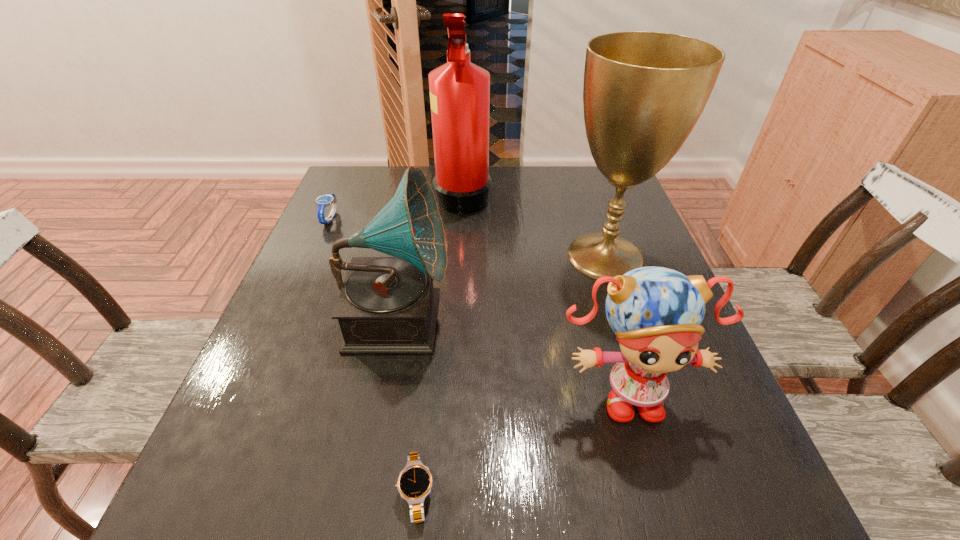
Identify the location of fire extinguisher. (459, 90).

Identify the location of trophy cup. This screenshot has width=960, height=540. (643, 93).

I want to click on the fourth shortest object, so click(x=387, y=305).

Locate an element on the screen. The image size is (960, 540). the second nearest object is located at coordinates (656, 313).

Where is `the third shortest object`? the third shortest object is located at coordinates (656, 313).

I want to click on the farther watch, so click(x=322, y=201).

Locate an element on the screen. This screenshot has width=960, height=540. the left watch is located at coordinates (322, 201).

You are a GUI agent. You are given a task and a screenshot of the screen. Output one action in this format:
    pyautogui.click(x=<x>, y=<y>)
    Task: Click on the nearest object
    This screenshot has width=960, height=540.
    Given the screenshot: What is the action you would take?
    pyautogui.click(x=414, y=484)

You are a GUI agent. You are given a task and a screenshot of the screen. Output one action in this format:
    pyautogui.click(x=<x>, y=<y>)
    Task: Click on the right watch
    
    Given the screenshot: What is the action you would take?
    pyautogui.click(x=414, y=484)

At what (x,y) coordinates should I click in order to perform the action: click on vacant space located at the spray nozzle of the fire extinguisher. Please return your answer as a coordinate pair (x, y). Image resolution: width=960 pixels, height=540 pixels. Looking at the image, I should click on (519, 194).